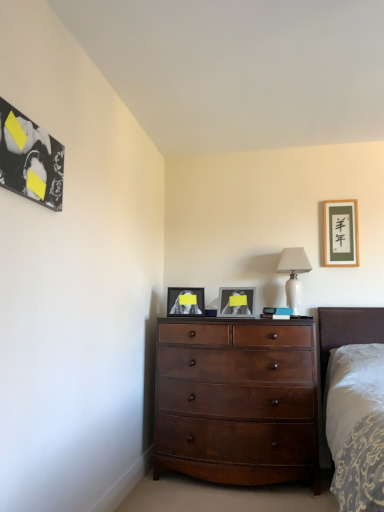
Question: From a real-world perspective, is matte gold picture frame at upper right, the 1th picture frame when ordered from back to front, above or below white glossy table lamp at upper right?

Choices:
 (A) above
 (B) below

Answer: (A)

Question: Considering their positions, is matte gold picture frame at upper right, positioned as the first picture frame in right-to-left order, located in front of or behind white glossy table lamp at upper right?

Choices:
 (A) behind
 (B) front

Answer: (A)

Question: Which object is positioned closest to the white glossy table lamp at upper right?

Choices:
 (A) matte black picture frame at center, arranged as the 2th picture frame when viewed from the back
 (B) mahogany wood dresser at center
 (C) white glossy picture frame at center, acting as the second picture frame starting from the right
 (D) matte gold picture frame at upper right, the 1th picture frame when ordered from back to front
 (E) black glossy picture frame at upper left, acting as the 1th picture frame starting from the front

Answer: (D)

Question: Which is nearer to the white glossy picture frame at center, which ranks as the 2th picture frame in front-to-back order?

Choices:
 (A) matte black picture frame at center, the third picture frame positioned from the front
 (B) black glossy picture frame at upper left, acting as the first picture frame starting from the left
 (C) mahogany wood dresser at center
 (D) white glossy table lamp at upper right
 (E) matte gold picture frame at upper right, the 1th picture frame when ordered from back to front

Answer: (A)